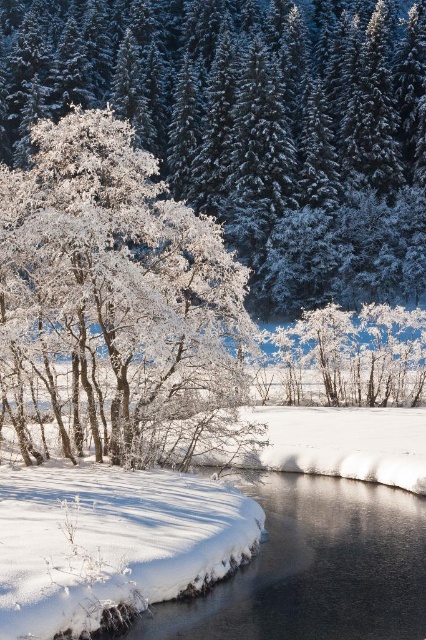
Is white frosty tree at upper left thinner than frosted white tree at center?

Incorrect, white frosty tree at upper left's width is not less than frosted white tree at center's.

Does white frosty tree at upper left have a smaller size compared to frosted white tree at center?

Actually, white frosty tree at upper left might be larger than frosted white tree at center.

Which is behind, point (146, 76) or point (40, 353)?

Positioned behind is point (146, 76).

What are the coordinates of `white frosty tree at upper left` in the screenshot? It's located at (252, 124).